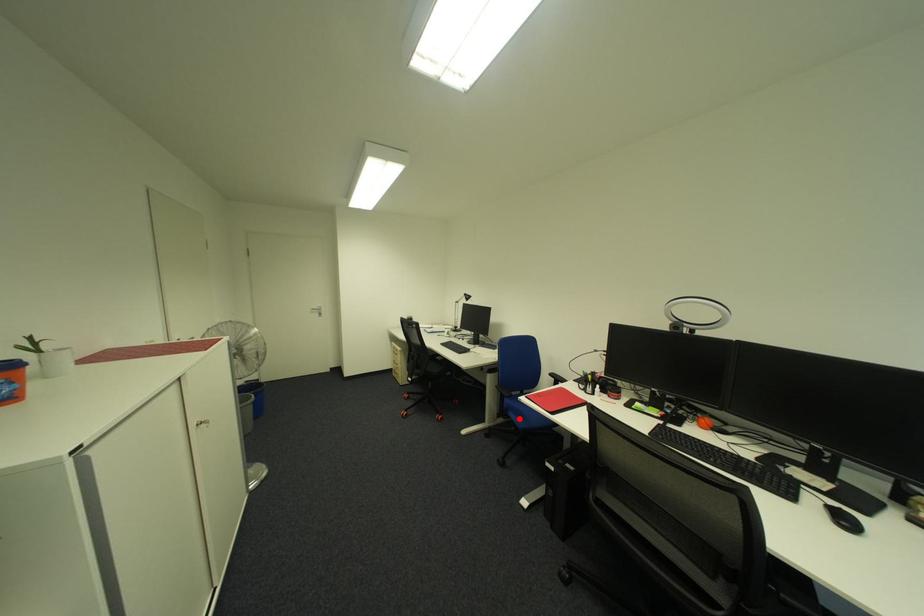
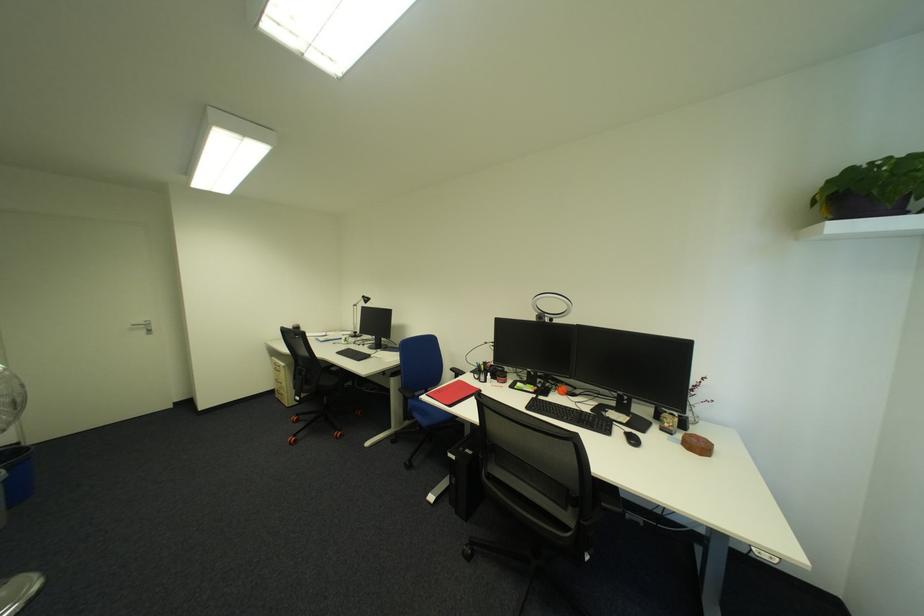
Where in the second image is the point corresponding to the highlighted location from the first image?

(424, 419)